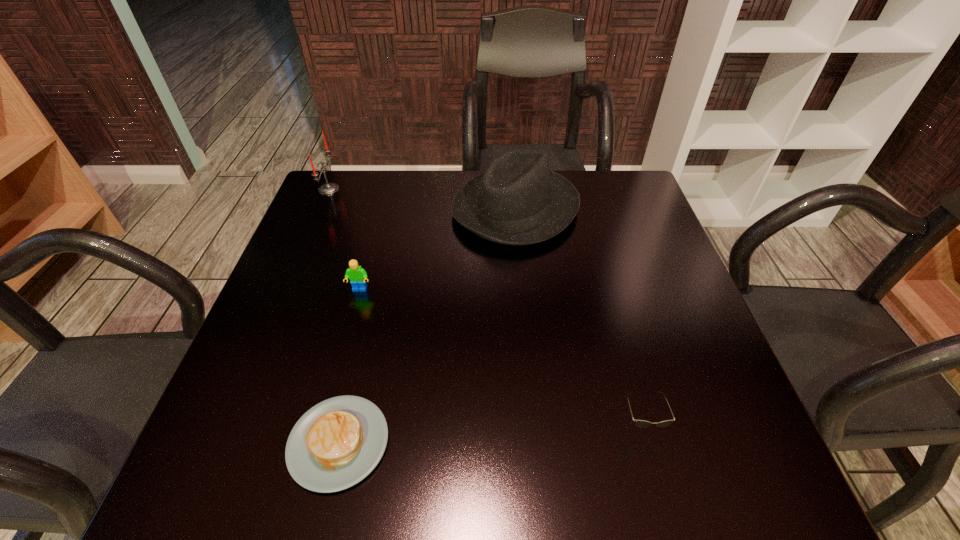
Locate an element on the screen. This screenshot has height=540, width=960. fedora that is at the far edge is located at coordinates (518, 201).

In order to click on sunglasses present at the near edge in this screenshot , I will do `click(639, 423)`.

The image size is (960, 540). I want to click on pancake that is at the near edge, so click(337, 443).

Locate an element on the screen. The width and height of the screenshot is (960, 540). candle that is at the left edge is located at coordinates (328, 188).

Find the location of a particular element. The width and height of the screenshot is (960, 540). Lego located at the left edge is located at coordinates (357, 275).

You are a GUI agent. You are given a task and a screenshot of the screen. Output one action in this format:
    pyautogui.click(x=<x>, y=<y>)
    Task: Click on the pancake that is at the left edge
    Image resolution: width=960 pixels, height=540 pixels.
    Given the screenshot: What is the action you would take?
    pyautogui.click(x=337, y=443)

I want to click on object present at the right edge, so click(639, 423).

The height and width of the screenshot is (540, 960). Find the location of `object that is at the far left corner`. object that is at the far left corner is located at coordinates (328, 188).

Find the location of a particular element. object present at the near left corner is located at coordinates (337, 443).

Image resolution: width=960 pixels, height=540 pixels. In order to click on object that is at the near right corner in this screenshot , I will do `click(639, 423)`.